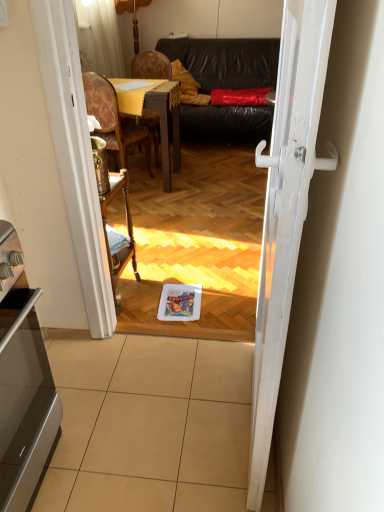
Find the location of a particular element. vacant area that lies in front of woodenmaterial/texturetable at upper center is located at coordinates [156, 208].